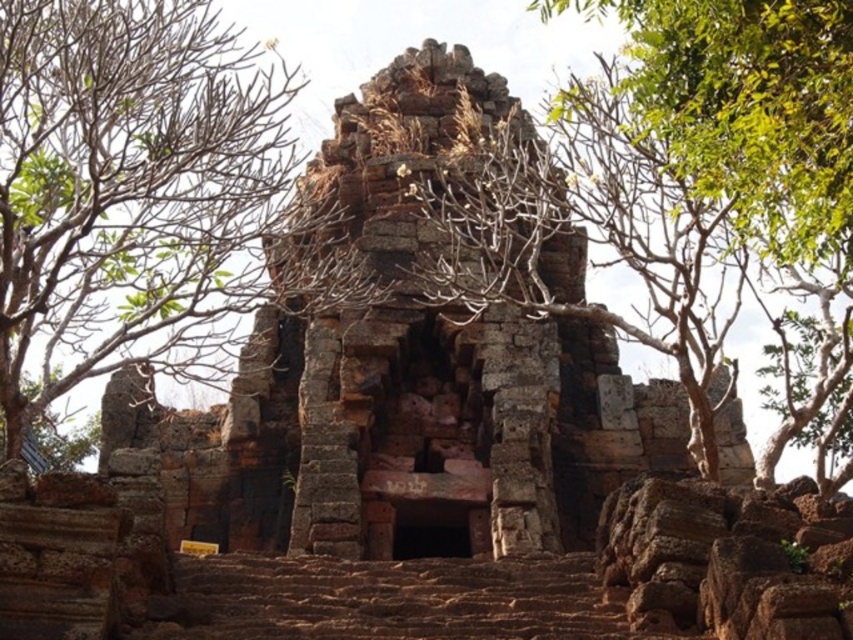
Question: Which point is closer to the camera?

Choices:
 (A) green leafy tree at upper center
 (B) green leafy tree at left

Answer: (A)

Question: Is the position of green leafy tree at left more distant than that of green leafy tree at upper center?

Choices:
 (A) yes
 (B) no

Answer: (A)

Question: Where is green leafy tree at left located in relation to green leafy tree at upper center in the image?

Choices:
 (A) below
 (B) above

Answer: (A)

Question: Is green leafy tree at left further to camera compared to green leafy tree at upper center?

Choices:
 (A) yes
 (B) no

Answer: (A)